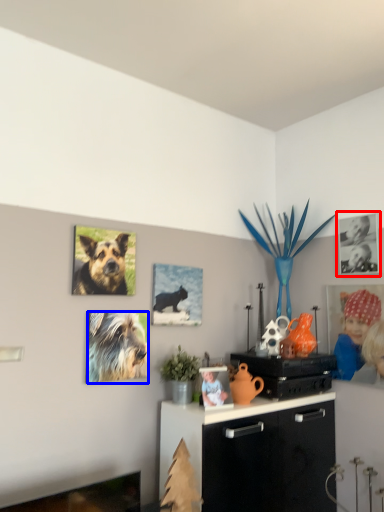
Question: Which object appears closest to the camera in this image, picture frame (highlighted by a red box) or dog (highlighted by a blue box)?

Choices:
 (A) picture frame
 (B) dog

Answer: (B)